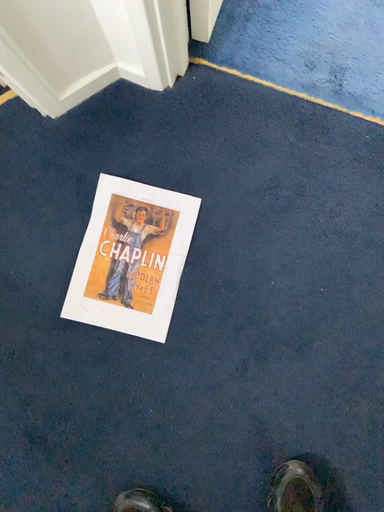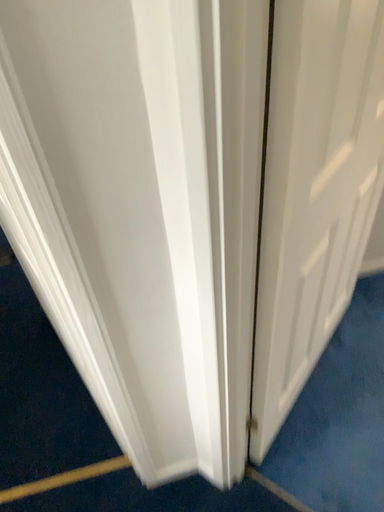
Question: Which way did the camera rotate in the video?

Choices:
 (A) rotated upward
 (B) rotated downward

Answer: (A)